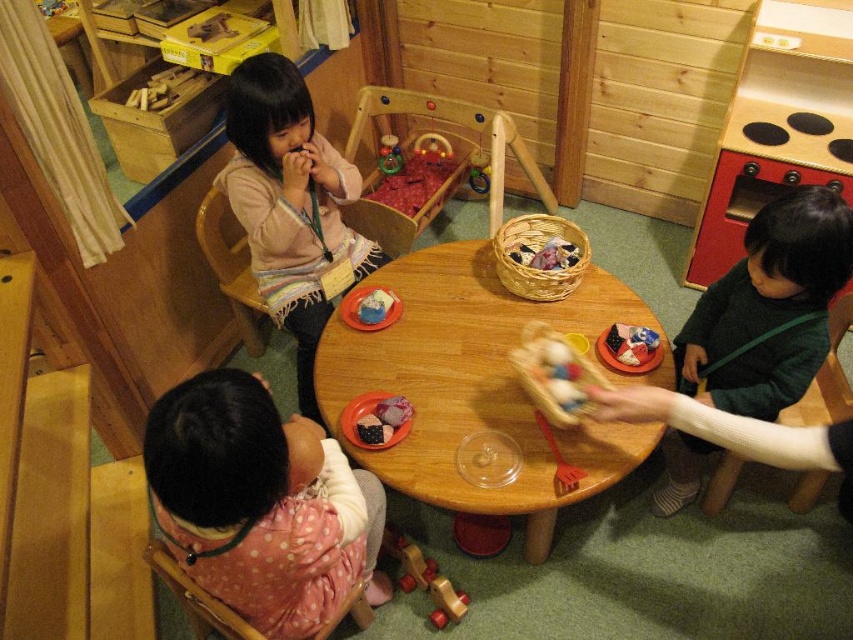
Based on the photo, is pink polka dot dress at lower left bigger than smooth plastic toy at center?

Yes.

This screenshot has width=853, height=640. Find the location of `pink polka dot dress at lower left`. pink polka dot dress at lower left is located at coordinates (260, 502).

Where is `pink polka dot dress at lower left`? The image size is (853, 640). pink polka dot dress at lower left is located at coordinates (260, 502).

Is smooth matte fabric at table center to the left of smooth plastic toy at center from the viewer's perspective?

In fact, smooth matte fabric at table center is to the right of smooth plastic toy at center.

Can you confirm if smooth matte fabric at table center is smaller than smooth plastic toy at center?

Yes, smooth matte fabric at table center is smaller than smooth plastic toy at center.

This screenshot has width=853, height=640. Describe the element at coordinates (384, 413) in the screenshot. I see `smooth matte fabric at table center` at that location.

The height and width of the screenshot is (640, 853). I want to click on smooth matte fabric at table center, so click(x=384, y=413).

Is point (453, 300) positioned before point (374, 291)?

No, (453, 300) is further to viewer.

The image size is (853, 640). What do you see at coordinates (477, 385) in the screenshot? I see `wooden table at center` at bounding box center [477, 385].

Does point (409, 436) come behind point (379, 294)?

No.

Image resolution: width=853 pixels, height=640 pixels. I want to click on wooden table at center, so click(x=477, y=385).